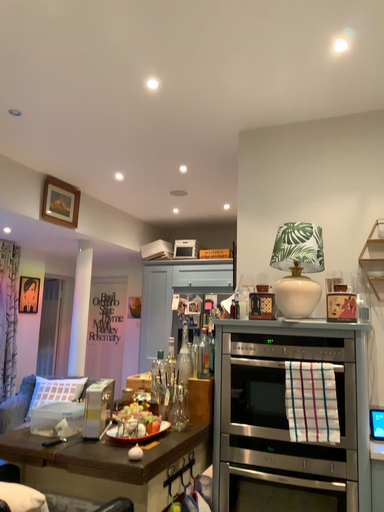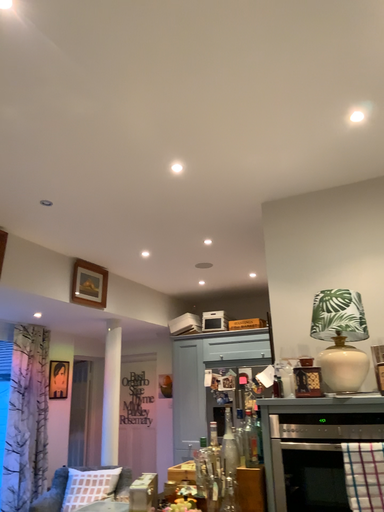
Question: How did the camera likely rotate when shooting the video?

Choices:
 (A) rotated upward
 (B) rotated downward

Answer: (A)